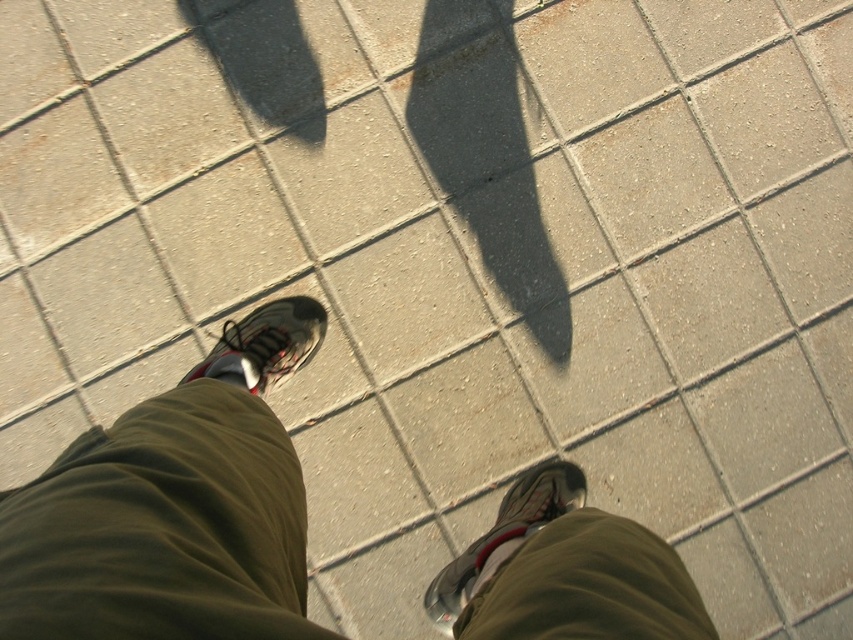
Is khaki cotton pants at center wider than matte black shoe at center?

Yes.

Does khaki cotton pants at center have a larger size compared to matte black shoe at center?

Yes.

Is point (247, 525) more distant than point (234, 326)?

That is False.

Where is `khaki cotton pants at center`? The image size is (853, 640). khaki cotton pants at center is located at coordinates (173, 508).

Where is `khaki cotton pants at center`? khaki cotton pants at center is located at coordinates (173, 508).

Looking at this image, which is above, khaki cotton pants at center or khaki pants at center?

khaki cotton pants at center is above.

What do you see at coordinates (173, 508) in the screenshot? I see `khaki cotton pants at center` at bounding box center [173, 508].

At what (x,y) coordinates should I click in order to perform the action: click on khaki cotton pants at center. Please return your answer as a coordinate pair (x, y). Looking at the image, I should click on (173, 508).

Is point (541, 472) farther from camera compared to point (235, 364)?

Yes, it is.

Is shiny metallic shoe at lower center further to the viewer compared to matte black shoe at center?

No, it is not.

Does point (534, 474) come closer to viewer compared to point (271, 339)?

No, it is behind (271, 339).

This screenshot has width=853, height=640. What are the coordinates of `shiny metallic shoe at lower center` in the screenshot? It's located at (505, 532).